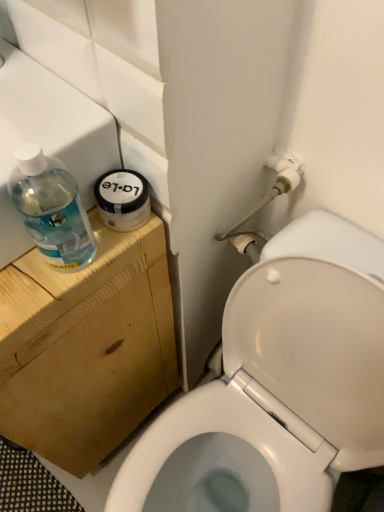
Question: Is transparent plastic sink at upper left, positioned as the first sink in front-to-back order, beside transparent plastic sink at upper left, the first sink viewed from the back?

Choices:
 (A) yes
 (B) no

Answer: (B)

Question: Considering the relative sizes of transparent plastic sink at upper left, positioned as the first sink in front-to-back order, and transparent plastic sink at upper left, which appears as the 2th sink when viewed from the front, in the image provided, is transparent plastic sink at upper left, positioned as the first sink in front-to-back order, smaller than transparent plastic sink at upper left, which appears as the 2th sink when viewed from the front,?

Choices:
 (A) no
 (B) yes

Answer: (B)

Question: Does transparent plastic sink at upper left, positioned as the first sink in front-to-back order, have a lesser width compared to transparent plastic sink at upper left, which appears as the 2th sink when viewed from the front?

Choices:
 (A) yes
 (B) no

Answer: (A)

Question: From the image's perspective, is transparent plastic sink at upper left, positioned as the first sink in front-to-back order, above transparent plastic sink at upper left, which appears as the 2th sink when viewed from the front?

Choices:
 (A) yes
 (B) no

Answer: (A)

Question: Is transparent plastic sink at upper left, the first sink viewed from the back, located within transparent plastic sink at upper left, the 2th sink in the back-to-front sequence?

Choices:
 (A) no
 (B) yes

Answer: (A)

Question: Considering the positions of white glossy toilet at lower right and transparent plastic bottle at left in the image, is white glossy toilet at lower right bigger or smaller than transparent plastic bottle at left?

Choices:
 (A) big
 (B) small

Answer: (A)

Question: Is white glossy toilet at lower right inside the boundaries of transparent plastic bottle at left, or outside?

Choices:
 (A) outside
 (B) inside

Answer: (A)

Question: In terms of height, does white glossy toilet at lower right look taller or shorter compared to transparent plastic bottle at left?

Choices:
 (A) tall
 (B) short

Answer: (A)

Question: In the image, is white glossy toilet at lower right on the left side or the right side of transparent plastic bottle at left?

Choices:
 (A) right
 (B) left

Answer: (A)

Question: Considering the positions of transparent plastic sink at upper left, positioned as the first sink in front-to-back order, and transparent plastic bottle at left in the image, is transparent plastic sink at upper left, positioned as the first sink in front-to-back order, taller or shorter than transparent plastic bottle at left?

Choices:
 (A) tall
 (B) short

Answer: (B)

Question: From the image's perspective, is transparent plastic sink at upper left, positioned as the first sink in front-to-back order, above or below transparent plastic bottle at left?

Choices:
 (A) below
 (B) above

Answer: (B)

Question: Considering the relative positions of transparent plastic sink at upper left, the 2th sink in the back-to-front sequence, and transparent plastic bottle at left in the image provided, is transparent plastic sink at upper left, the 2th sink in the back-to-front sequence, to the left or to the right of transparent plastic bottle at left?

Choices:
 (A) left
 (B) right

Answer: (A)

Question: Looking at their shapes, would you say transparent plastic sink at upper left, positioned as the first sink in front-to-back order, is wider or thinner than transparent plastic bottle at left?

Choices:
 (A) wide
 (B) thin

Answer: (A)

Question: From the image's perspective, relative to transparent plastic sink at upper left, the first sink viewed from the back, is white glossy toilet at lower right above or below?

Choices:
 (A) above
 (B) below

Answer: (B)

Question: Visually, is white glossy toilet at lower right positioned to the left or to the right of transparent plastic sink at upper left, which appears as the 2th sink when viewed from the front?

Choices:
 (A) left
 (B) right

Answer: (B)